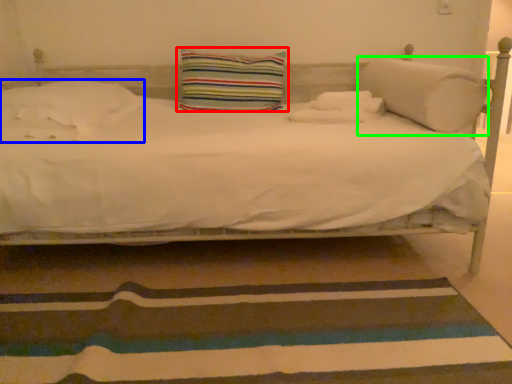
Question: Estimate the real-world distances between objects in this image. Which object is farther from pillow (highlighted by a red box), pillow (highlighted by a blue box) or pillow (highlighted by a green box)?

Choices:
 (A) pillow
 (B) pillow

Answer: (B)